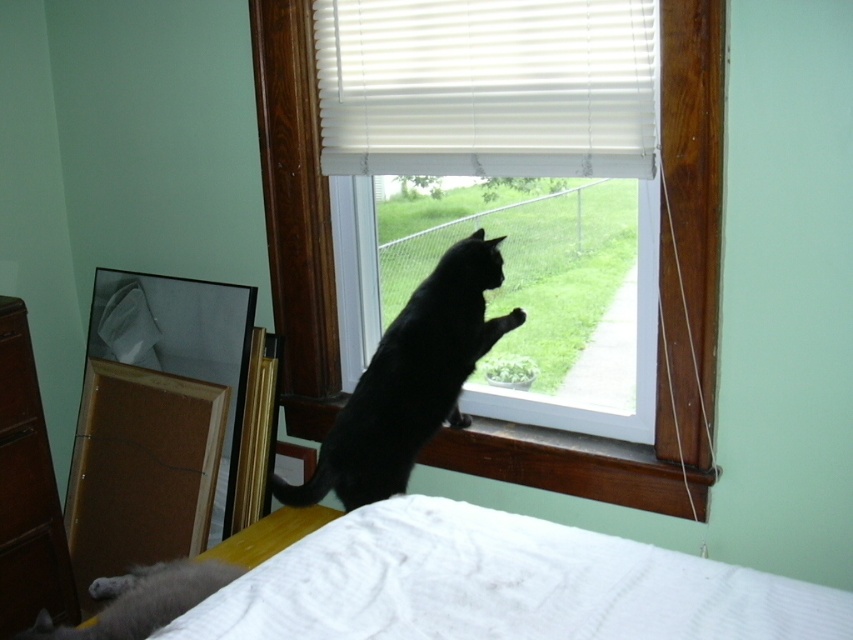
Question: Does white matte window at center have a smaller size compared to black matte fur cat at center?

Choices:
 (A) no
 (B) yes

Answer: (A)

Question: Can you confirm if black matte fur cat at center is positioned above brown wood drawer at left?

Choices:
 (A) no
 (B) yes

Answer: (A)

Question: Which object is farther from the camera taking this photo?

Choices:
 (A) black matte fur cat at center
 (B) brown wood dresser at left
 (C) brushed wood drawer at lower left
 (D) brown wooden screen door at left

Answer: (D)

Question: Which of the following is the farthest from the observer?

Choices:
 (A) (283, 628)
 (B) (4, 317)
 (C) (0, 604)

Answer: (C)

Question: Can you confirm if black matte fur cat at center is wider than wooden at lower center?

Choices:
 (A) no
 (B) yes

Answer: (B)

Question: Among these points, which one is nearest to the camera?

Choices:
 (A) (30, 364)
 (B) (704, 33)
 (C) (25, 416)

Answer: (B)